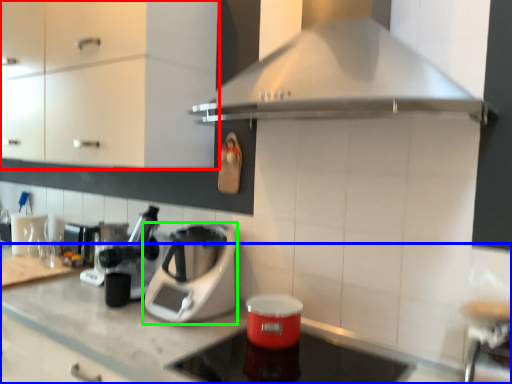
Question: Which object is the closest to the cabinetry (highlighted by a red box)? Choose among these: countertop (highlighted by a blue box) or kitchen appliance (highlighted by a green box).

Choices:
 (A) countertop
 (B) kitchen appliance

Answer: (B)